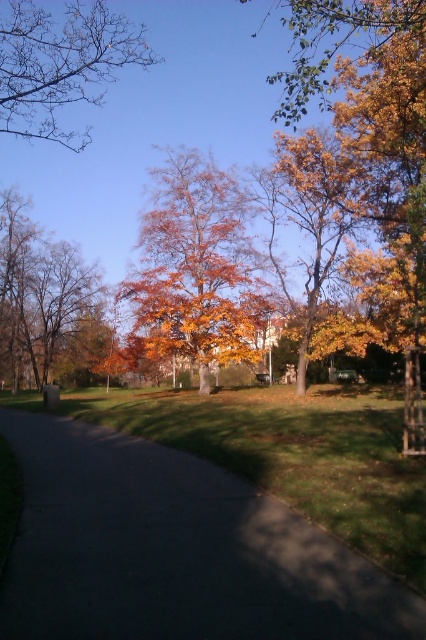
Question: Does orange leafy tree at center appear on the right side of brown matte tree at left?

Choices:
 (A) yes
 (B) no

Answer: (A)

Question: Estimate the real-world distances between objects in this image. Which object is closer to the brown matte tree at left?

Choices:
 (A) orange leafy tree at center
 (B) dark asphalt path at center
 (C) bare branches at upper left

Answer: (C)

Question: Is bare branches at upper left to the right of brown matte tree at left from the viewer's perspective?

Choices:
 (A) yes
 (B) no

Answer: (A)

Question: Is dark asphalt path at center thinner than orange leafy tree at center?

Choices:
 (A) no
 (B) yes

Answer: (B)

Question: Which point is farther to the camera?

Choices:
 (A) (52, 65)
 (B) (114, 532)

Answer: (A)

Question: Which of the following is the closest to the observer?

Choices:
 (A) (66, 260)
 (B) (164, 264)
 (C) (78, 33)

Answer: (C)